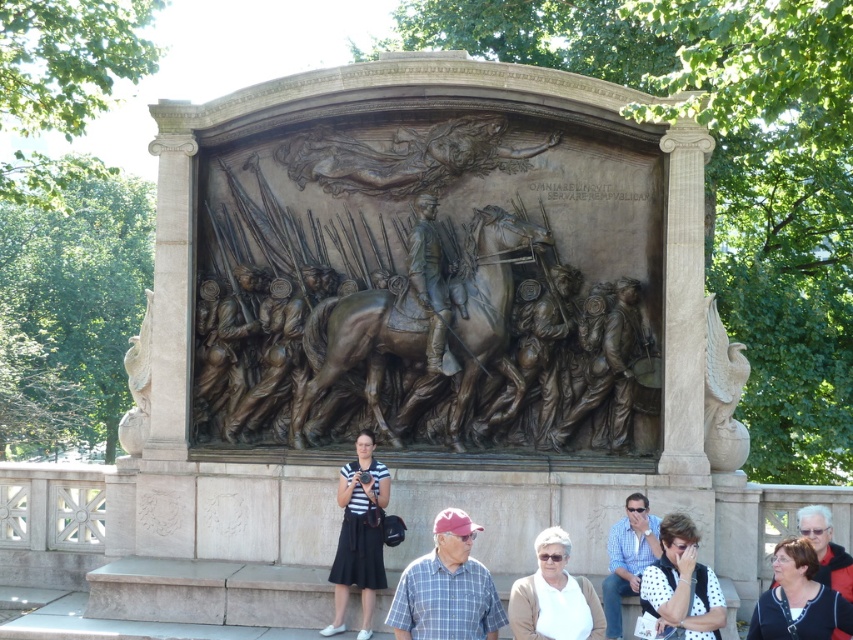
Question: Which point is closer to the camera?

Choices:
 (A) (463, 552)
 (B) (708, 605)
 (C) (851, 605)

Answer: (C)

Question: Based on their relative distances, which object is nearer to the white fabric at lower center?

Choices:
 (A) matte black jacket at lower right
 (B) bronze textured horse at center

Answer: (A)

Question: Which object is the closest to the matte black jacket at lower right?

Choices:
 (A) white dotted shirt at lower right
 (B) striped cotton shirt at center

Answer: (A)

Question: Does bronze textured horse at center appear over plaid shirt at center?

Choices:
 (A) yes
 (B) no

Answer: (A)

Question: Can you confirm if white dotted shirt at lower right is positioned to the right of matte black jacket at lower right?

Choices:
 (A) yes
 (B) no

Answer: (B)

Question: Does striped cotton shirt at center have a lesser width compared to matte black jacket at lower right?

Choices:
 (A) yes
 (B) no

Answer: (A)